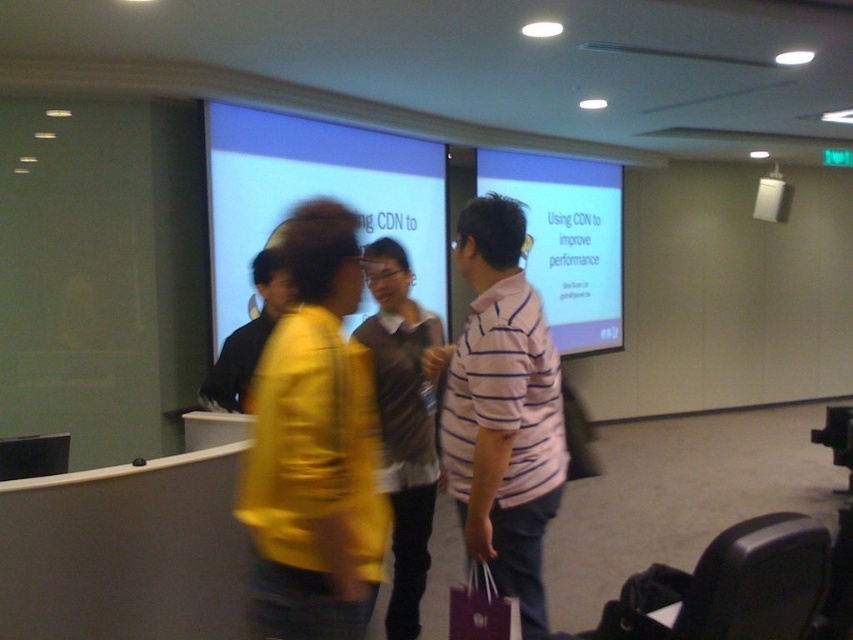
You are organizing a presentation in the conference room and need to place a name tag on either the pink striped shirt at center or the matte purple shopping bag at lower center. Which object should you choose to ensure the name tag is more visible to the audience?

The pink striped shirt at center has a greater height compared to the matte purple shopping bag at lower center, so placing the name tag on the pink striped shirt at center would make it more visible to the audience.

You are standing in the conference room and need to locate the person wearing the matte yellow jacket at center. According to the coordinates provided, where exactly should you look to find them?

The matte yellow jacket at center is located at point (314, 445), so you should look towards those coordinates to find the person wearing it.